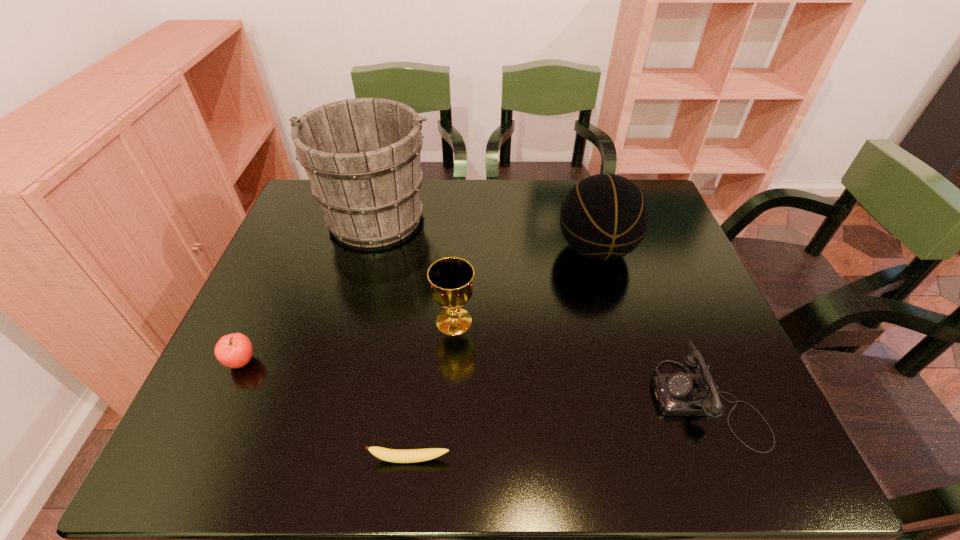
Identify the location of vacant region between the fifth shortest object and the tallest object. This screenshot has width=960, height=540. (486, 233).

This screenshot has width=960, height=540. I want to click on vacant space in between the second tallest object and the tallest object, so click(x=486, y=233).

Identify the location of free spot between the tallest object and the telephone. The height and width of the screenshot is (540, 960). (541, 308).

Locate an element on the screen. The image size is (960, 540). vacant space that is in between the shortest object and the telephone is located at coordinates (558, 429).

This screenshot has height=540, width=960. What are the coordinates of `blank region between the shortest object and the telephone` in the screenshot? It's located at (558, 429).

At what (x,y) coordinates should I click in order to perform the action: click on unoccupied area between the telephone and the banana. Please return your answer as a coordinate pair (x, y). Image resolution: width=960 pixels, height=540 pixels. Looking at the image, I should click on (558, 429).

The height and width of the screenshot is (540, 960). I want to click on object that can be found as the fifth closest to the shortest object, so click(x=362, y=156).

Image resolution: width=960 pixels, height=540 pixels. Identify the location of object identified as the closest to the basketball. (677, 394).

The image size is (960, 540). In order to click on vacant space that satisfies the following two spatial constraints: 1. on the back side of the apple; 2. on the left side of the basketball in this screenshot , I will do `click(292, 250)`.